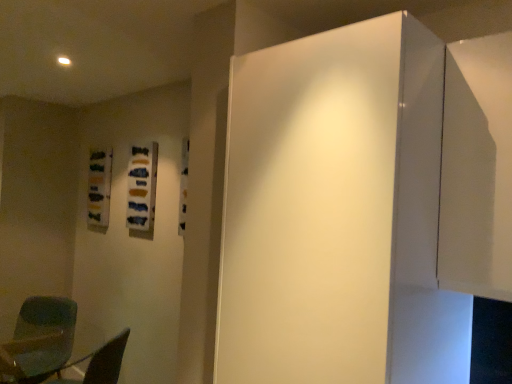
Question: Is matte green chair at lower left beside white glossy door at center?

Choices:
 (A) yes
 (B) no

Answer: (B)

Question: Is matte green chair at lower left not inside white glossy door at center?

Choices:
 (A) yes
 (B) no

Answer: (A)

Question: Is matte green chair at lower left bigger than white glossy door at center?

Choices:
 (A) yes
 (B) no

Answer: (B)

Question: Is the position of matte green chair at lower left more distant than that of white glossy door at center?

Choices:
 (A) yes
 (B) no

Answer: (A)

Question: Are matte green chair at lower left and white glossy door at center located far from each other?

Choices:
 (A) yes
 (B) no

Answer: (A)

Question: Considering the positions of white glossy door at center and matte green chair at lower left in the image, is white glossy door at center bigger or smaller than matte green chair at lower left?

Choices:
 (A) big
 (B) small

Answer: (A)

Question: From the image's perspective, is white glossy door at center located above or below matte green chair at lower left?

Choices:
 (A) above
 (B) below

Answer: (A)

Question: Is white glossy door at center to the left or to the right of matte green chair at lower left in the image?

Choices:
 (A) right
 (B) left

Answer: (A)

Question: Relative to matte green chair at lower left, is white glossy door at center in front or behind?

Choices:
 (A) behind
 (B) front

Answer: (B)

Question: Is matte green chair at lower left spatially inside transparent plastic chair at lower left, or outside of it?

Choices:
 (A) inside
 (B) outside

Answer: (B)

Question: From a real-world perspective, is matte green chair at lower left above or below transparent plastic chair at lower left?

Choices:
 (A) below
 (B) above

Answer: (A)

Question: Considering the positions of matte green chair at lower left and transparent plastic chair at lower left in the image, is matte green chair at lower left taller or shorter than transparent plastic chair at lower left?

Choices:
 (A) tall
 (B) short

Answer: (A)

Question: Is point (74, 306) closer or farther from the camera than point (70, 380)?

Choices:
 (A) farther
 (B) closer

Answer: (A)

Question: In the image, is white glossy door at center positioned in front of or behind transparent plastic chair at lower left?

Choices:
 (A) front
 (B) behind

Answer: (A)

Question: In terms of width, does white glossy door at center look wider or thinner when compared to transparent plastic chair at lower left?

Choices:
 (A) thin
 (B) wide

Answer: (B)